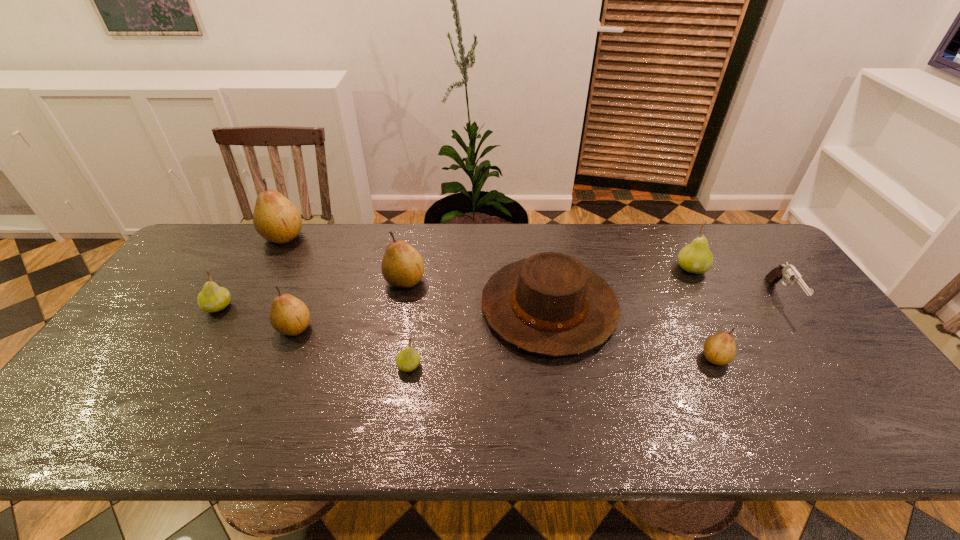
Locate which brown pear is the closest to the second biggest brown pear. Please provide its 2D coordinates. Your answer should be formatted as a tuple, i.e. [(x, y)], where the tuple contains the x and y coordinates of a point satisfying the conditions above.

[(290, 316)]

Where is `green pear that is the second nearest to the second green pear from right to left`? green pear that is the second nearest to the second green pear from right to left is located at coordinates (696, 257).

I want to click on the closest green pear to the cowboy hat, so click(x=408, y=359).

Find the location of a particular element. vacant area in the image that satisfies the following two spatial constraints: 1. on the front side of the third biggest brown pear; 2. on the left side of the tallest pear is located at coordinates (233, 327).

Where is `vacant area that satisfies the following two spatial constraints: 1. on the back side of the leftmost green pear; 2. on the left side of the fourth object from right to left`? vacant area that satisfies the following two spatial constraints: 1. on the back side of the leftmost green pear; 2. on the left side of the fourth object from right to left is located at coordinates (219, 307).